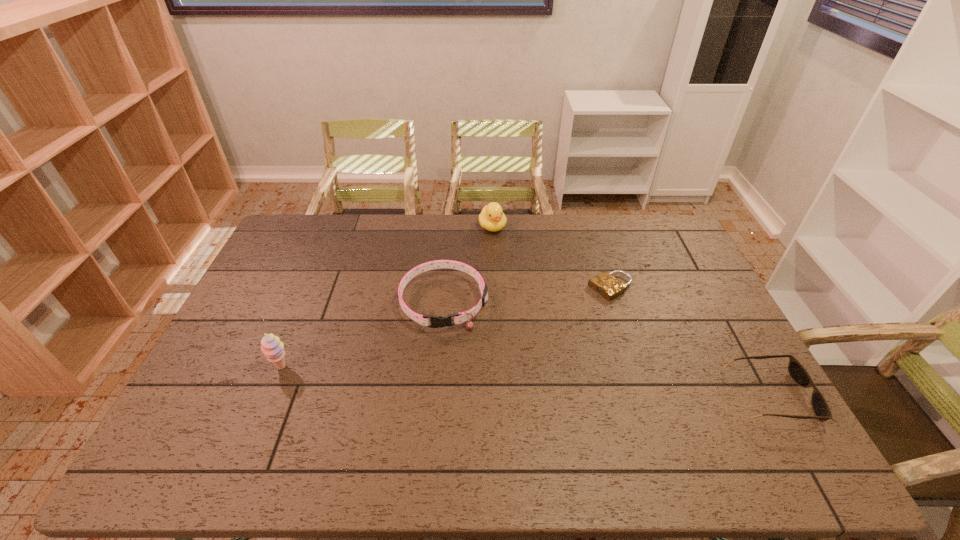
Where is `vacant region that satisfies the following two spatial constraints: 1. on the front side of the second object from right to left; 2. on the lenses of the fourth tallest object`? vacant region that satisfies the following two spatial constraints: 1. on the front side of the second object from right to left; 2. on the lenses of the fourth tallest object is located at coordinates (645, 396).

This screenshot has height=540, width=960. What are the coordinates of `vacant area that satisfies the following two spatial constraints: 1. on the front side of the rightmost object; 2. on the lenses of the farthest object` in the screenshot? It's located at (498, 396).

This screenshot has height=540, width=960. I want to click on free space that satisfies the following two spatial constraints: 1. on the back side of the second object from right to left; 2. on the left side of the tallest object, so click(x=314, y=287).

Find the location of a particular element. vacant area that satisfies the following two spatial constraints: 1. on the front side of the rightmost object; 2. on the lenses of the second object from right to left is located at coordinates (645, 396).

This screenshot has width=960, height=540. In order to click on free location that satisfies the following two spatial constraints: 1. on the back side of the fourth object from left to right; 2. on the left side of the leftmost object in this screenshot , I will do `click(314, 287)`.